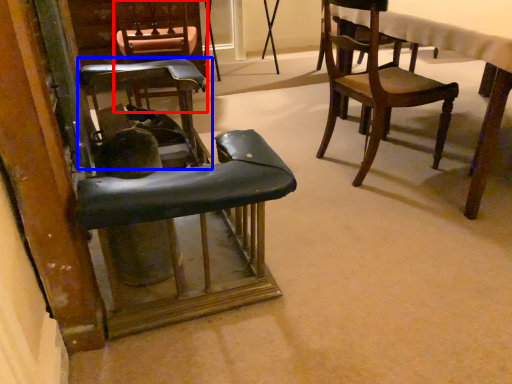
Question: Which object appears closest to the camera in this image, chair (highlighted by a red box) or chair (highlighted by a blue box)?

Choices:
 (A) chair
 (B) chair

Answer: (B)